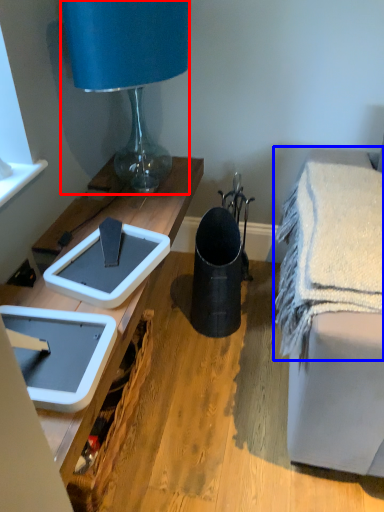
Question: Which object appears closest to the camera in this image, lamp (highlighted by a red box) or bath towel (highlighted by a blue box)?

Choices:
 (A) lamp
 (B) bath towel

Answer: (B)